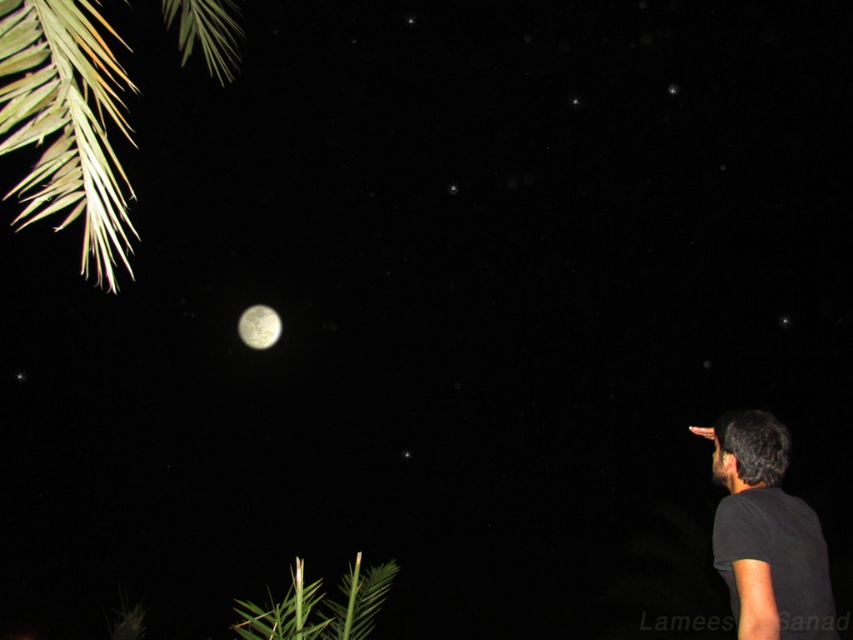
Question: Which object is farther from the camera taking this photo?

Choices:
 (A) smooth silver moon at center
 (B) black matte shirt at lower right

Answer: (A)

Question: Which of the following is the farthest from the observer?

Choices:
 (A) smooth silver moon at center
 (B) black matte shirt at lower right
 (C) green leafy branch at upper left

Answer: (A)

Question: Is green leafy branch at upper left to the left of smooth silver moon at center from the viewer's perspective?

Choices:
 (A) yes
 (B) no

Answer: (B)

Question: Can you confirm if green leafy branch at upper left is thinner than black matte shirt at lower right?

Choices:
 (A) no
 (B) yes

Answer: (A)

Question: Which object appears closest to the camera in this image?

Choices:
 (A) green leafy branch at upper left
 (B) black matte shirt at lower right
 (C) smooth silver moon at center

Answer: (A)

Question: Is black matte shirt at lower right smaller than smooth silver moon at center?

Choices:
 (A) no
 (B) yes

Answer: (A)